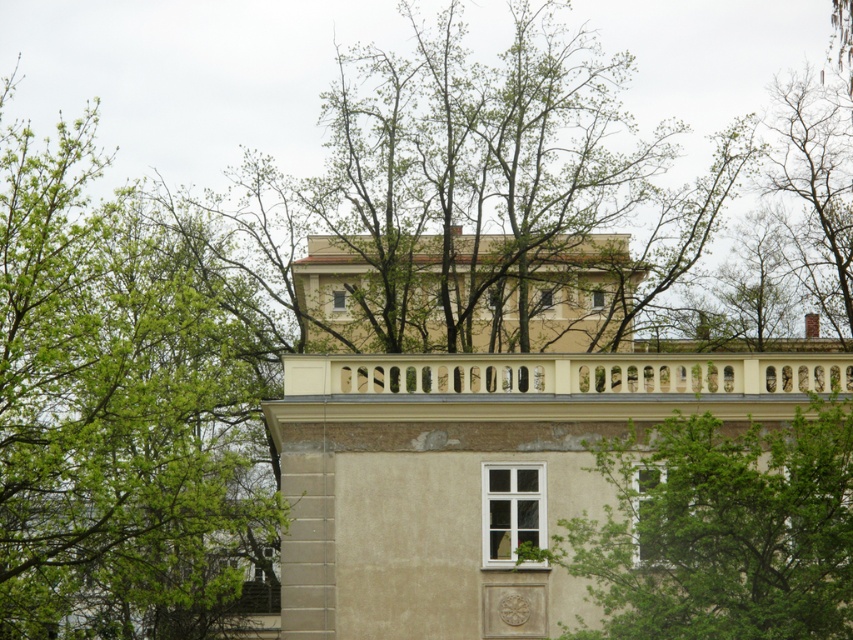
Question: Does green leafy tree at upper left appear on the left side of green leafy tree at center?

Choices:
 (A) yes
 (B) no

Answer: (A)

Question: Which object is the closest to the beige stone balcony at upper center?

Choices:
 (A) green leafy tree at center
 (B) green leafy tree at upper left

Answer: (A)

Question: Which object is closer to the camera taking this photo?

Choices:
 (A) green leafy tree at upper left
 (B) green leafy tree at center
 (C) beige stone balcony at upper center

Answer: (B)

Question: Where is green leafy tree at upper left located in relation to green leafy tree at center in the image?

Choices:
 (A) right
 (B) left

Answer: (B)

Question: In this image, where is green leafy tree at upper left located relative to beige stone balcony at upper center?

Choices:
 (A) right
 (B) left

Answer: (B)

Question: Which point is farther to the camera?

Choices:
 (A) green leafy tree at upper left
 (B) green leafy tree at center
 (C) beige stone balcony at upper center

Answer: (C)